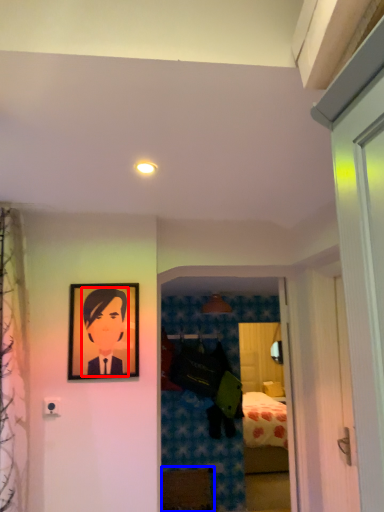
Question: Which object is closer to the camera taking this photo, person (highlighted by a red box) or furniture (highlighted by a blue box)?

Choices:
 (A) person
 (B) furniture

Answer: (A)